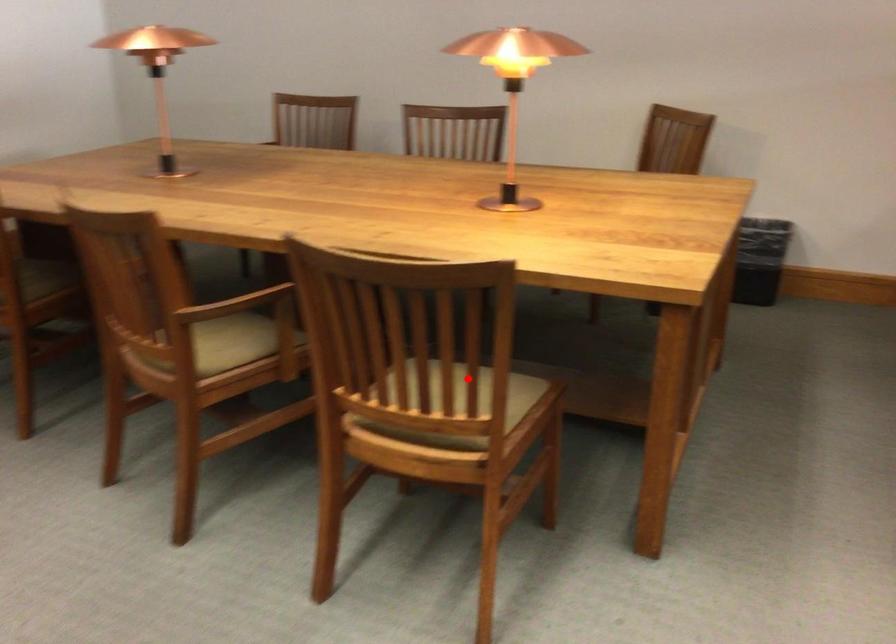
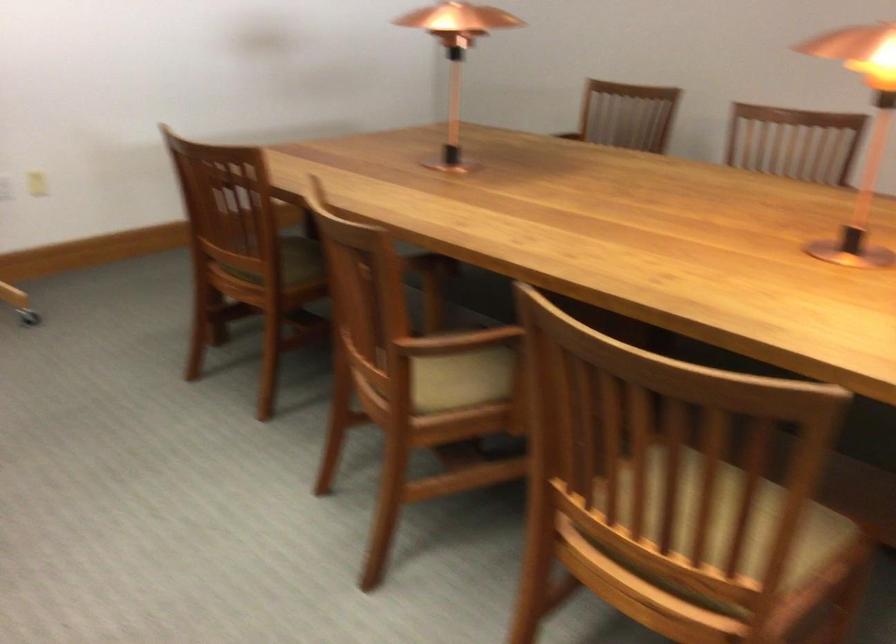
Question: I am providing you with two images of the same scene from different viewpoints. A red point is shown in image1. For the corresponding object point in image2, is it positioned nearer or farther from the camera?

Choices:
 (A) Nearer
 (B) Farther

Answer: (A)